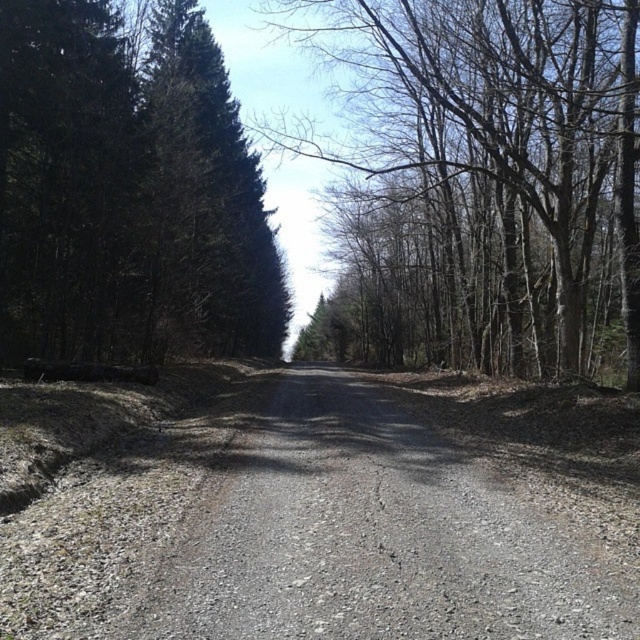
Between gray gravel road at center and dark green textured tree at left, which one is positioned lower?

Positioned lower is gray gravel road at center.

Locate an element on the screen. The height and width of the screenshot is (640, 640). gray gravel road at center is located at coordinates (371, 538).

Looking at this image, does bare branches at center have a lesser height compared to gray gravel road at center?

Incorrect, bare branches at center's height does not fall short of gray gravel road at center's.

Is bare branches at center bigger than gray gravel road at center?

Indeed, bare branches at center has a larger size compared to gray gravel road at center.

Between point (500, 204) and point (337, 563), which one is positioned behind?

Point (500, 204)

I want to click on bare branches at center, so click(484, 176).

Measure the distance between bare branches at center and dark green textured tree at left.

A distance of 12.60 meters exists between bare branches at center and dark green textured tree at left.

Locate an element on the screen. This screenshot has width=640, height=640. bare branches at center is located at coordinates (484, 176).

Is point (630, 154) closer to viewer compared to point (100, 308)?

That is True.

You are a GUI agent. You are given a task and a screenshot of the screen. Output one action in this format:
    pyautogui.click(x=<x>, y=<y>)
    Task: Click on the bare branches at center
    The height and width of the screenshot is (640, 640).
    Given the screenshot: What is the action you would take?
    tap(484, 176)